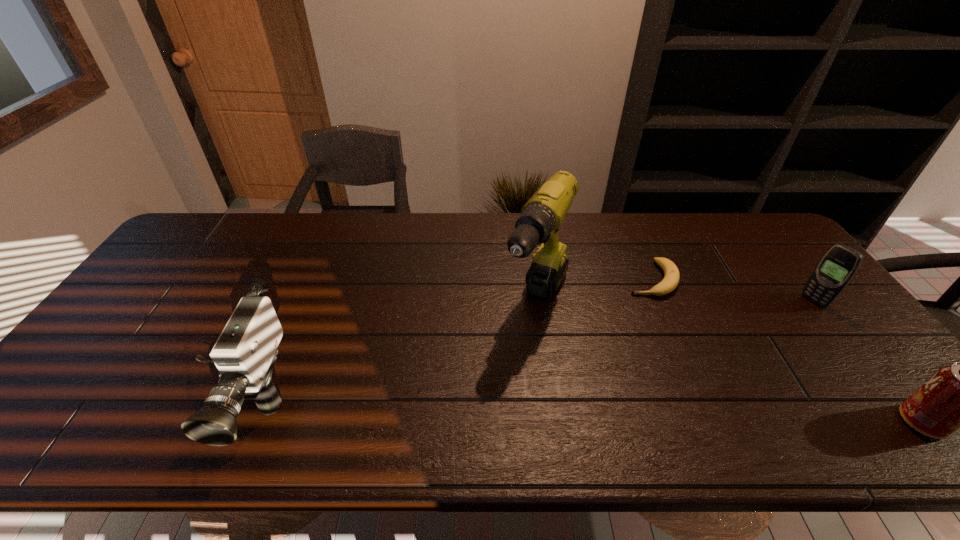
You are a GUI agent. You are given a task and a screenshot of the screen. Output one action in this format:
    pyautogui.click(x=<x>, y=<y>)
    Task: Click on the vacant space located 0.230m at the stem of the shortest object
    
    Given the screenshot: What is the action you would take?
    pos(616,349)

This screenshot has height=540, width=960. What are the coordinates of `vacant area situated at the stem of the shortest object` in the screenshot? It's located at (626, 332).

I want to click on blank area located on the handle side of the tallest object, so click(495, 397).

Identify the location of free space located on the handle side of the tallest object. (502, 384).

What are the coordinates of `vacant space located on the screen of the cellular telephone` in the screenshot? It's located at tap(783, 322).

Image resolution: width=960 pixels, height=540 pixels. I want to click on vacant space located on the screen of the cellular telephone, so click(x=738, y=350).

Image resolution: width=960 pixels, height=540 pixels. I want to click on vacant space situated on the screen of the cellular telephone, so click(743, 347).

Locate an element on the screen. camcorder at the near edge is located at coordinates (245, 353).

Where is `soda can that is at the near edge`? The width and height of the screenshot is (960, 540). soda can that is at the near edge is located at coordinates (959, 396).

In order to click on soda can at the right edge in this screenshot , I will do `click(959, 396)`.